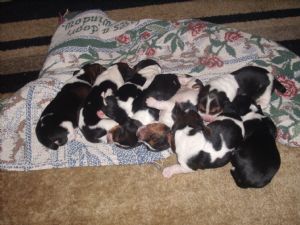
Image resolution: width=300 pixels, height=225 pixels. Identify the location of quilt. pos(225,52).